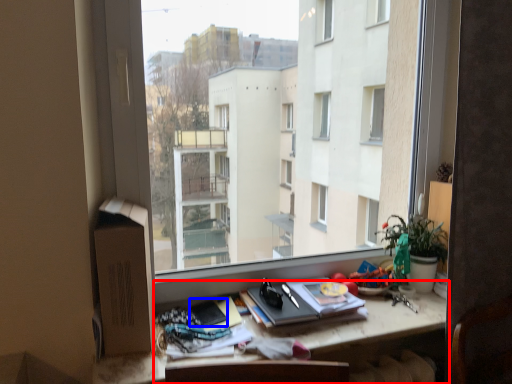
Question: Which of the following is the closest to the observer, desk (highlighted by a red box) or paperback book (highlighted by a blue box)?

Choices:
 (A) desk
 (B) paperback book

Answer: (A)